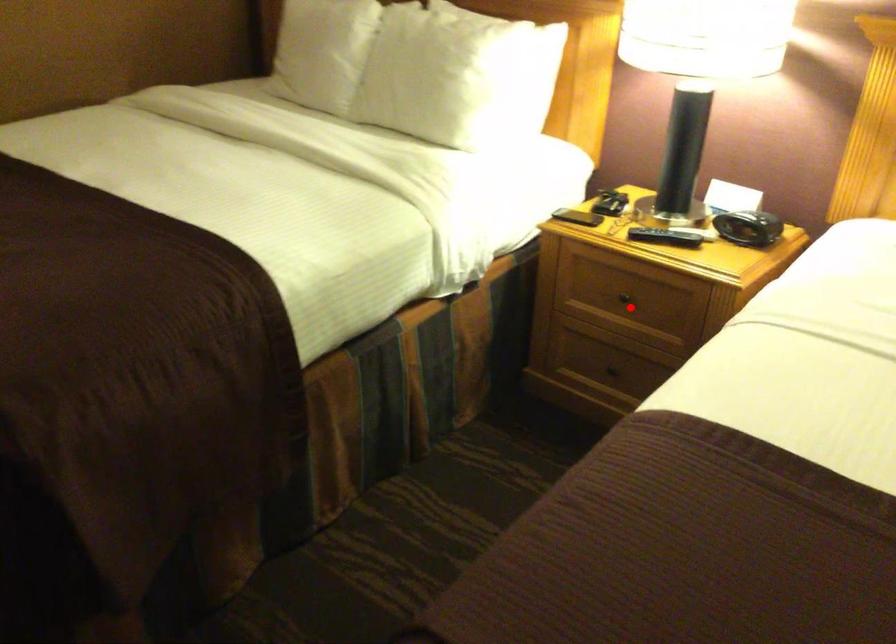
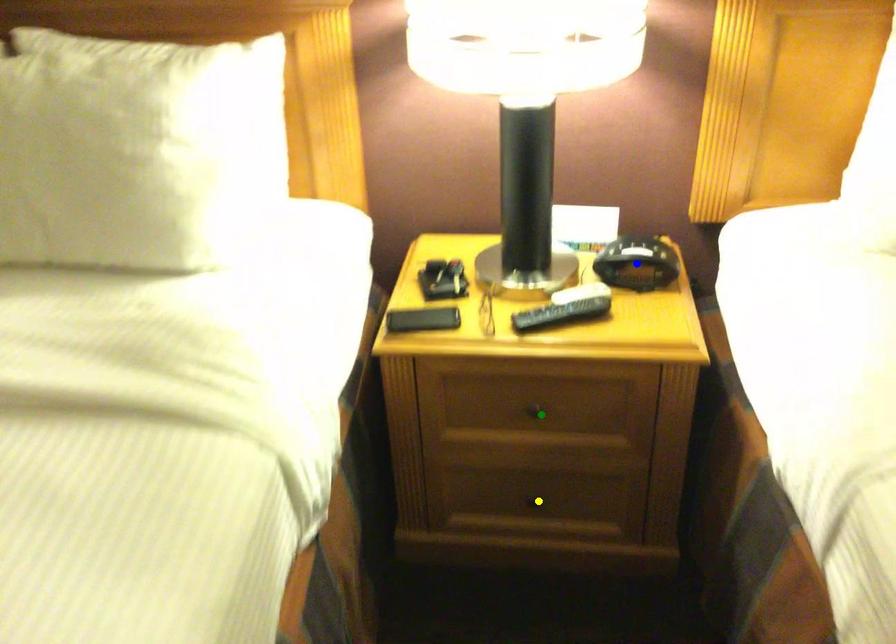
Question: I am providing you with two images of the same scene from different viewpoints. A red point is marked on the first image. You are given multiple points on the second image. In image 2, which mark is for the same physical point as the one in image 1?

Choices:
 (A) blue point
 (B) green point
 (C) yellow point

Answer: (B)